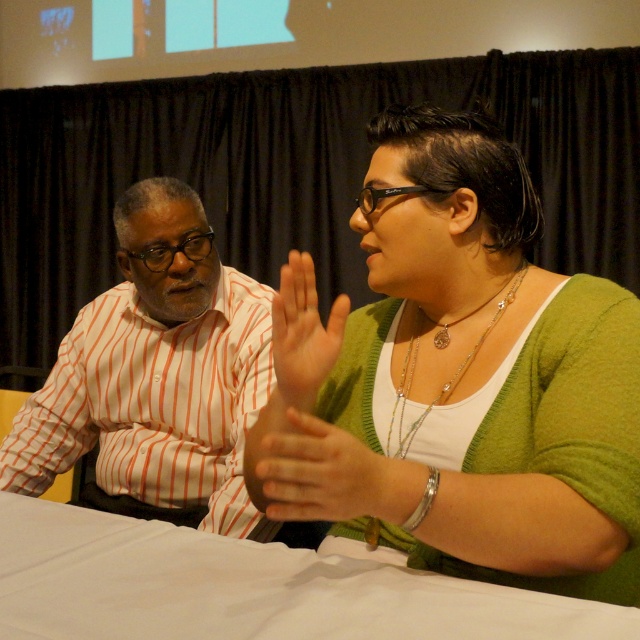
You are a photographer at a formal event. You need to adjust the lighting so that both the striped cotton shirt at left and the matte skin palm at center are equally visible. Given their sizes, which object requires more light adjustment?

The matte skin palm at center requires more light adjustment because it is smaller in size compared to the striped cotton shirt at left, so it needs more focused lighting to ensure visibility.

You are a photographer at a formal event. You want to capture a closeup shot of the striped cotton shirt at left and the smooth skin hand at center. Which object should you focus on first if you want to ensure both are in focus without adjusting the camera settings?

The striped cotton shirt at left has a greater height compared to the smooth skin hand at center, so focusing on the striped cotton shirt at left first would ensure both are in focus since it is larger and closer to the camera.

You are attending a formal event and need to place a small decorative item exactly halfway between point 1 at point (168,317) and point 2 at point (294,284). Will this item be closer to the speaker or the listener?

The halfway point between point 1 at (168,317) and point 2 at (294,284) will be closer to the speaker because point 1 is behind point 2, meaning the speaker is at point 2 and the listener is at point 1.